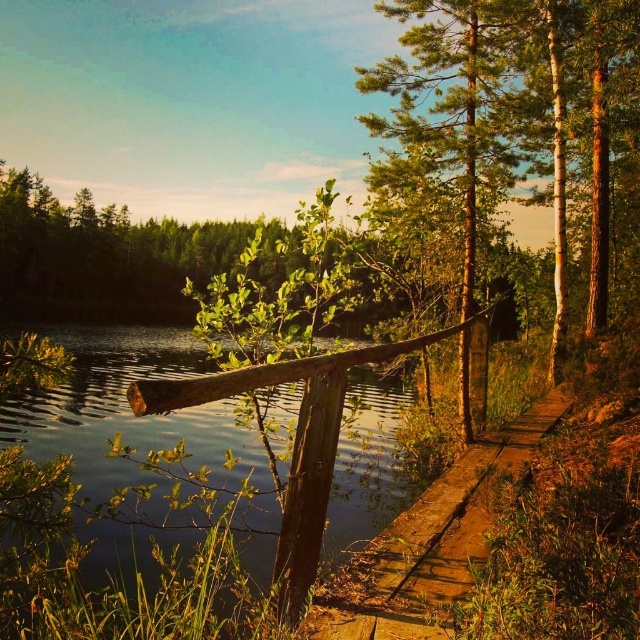
This screenshot has width=640, height=640. In order to click on transparent water at lower left in this screenshot , I will do `click(157, 545)`.

This screenshot has height=640, width=640. I want to click on transparent water at lower left, so click(157, 545).